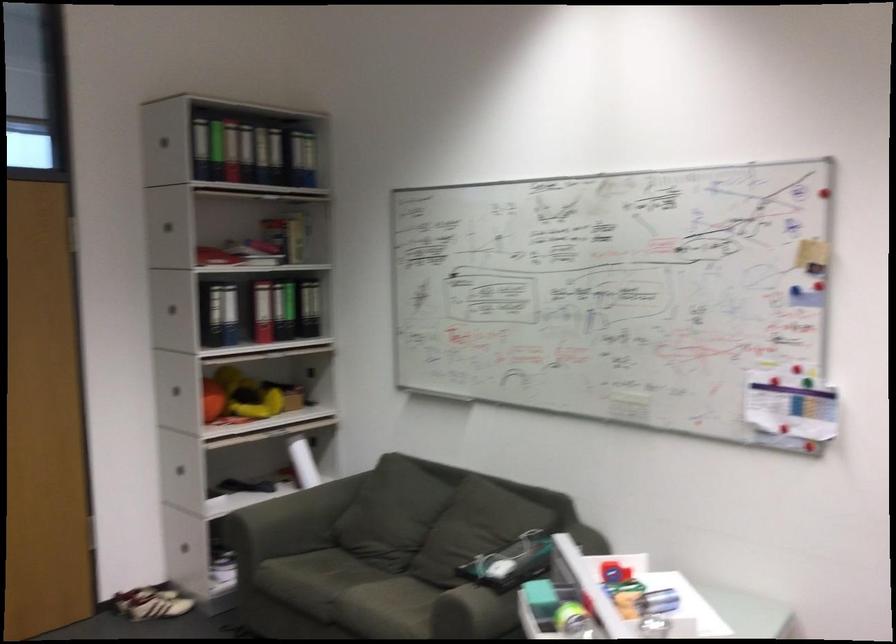
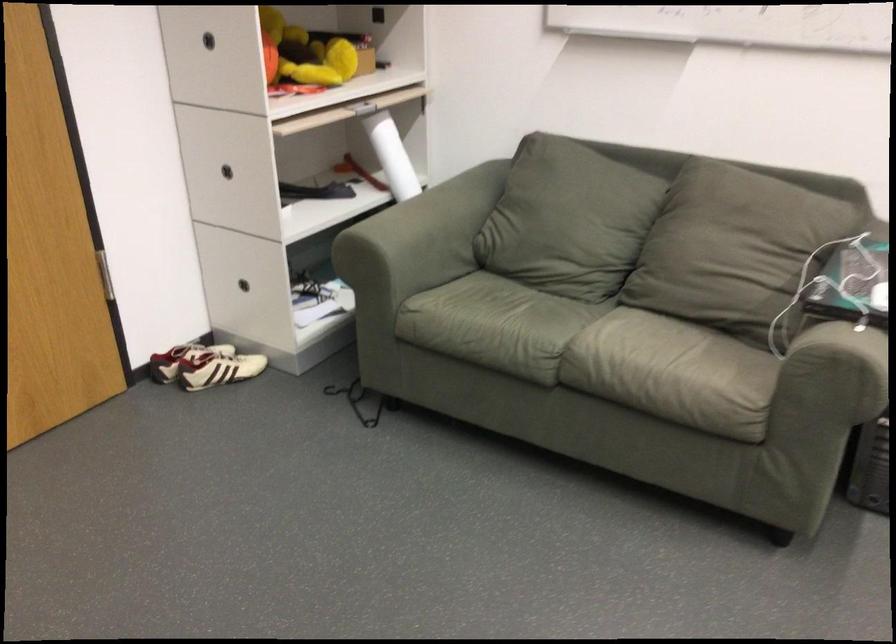
Locate, in the second image, the point that corresponds to (182,558) in the first image.

(252, 283)